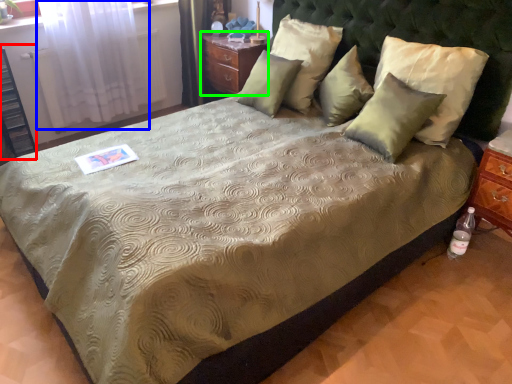
Question: Considering the real-world distances, which object is closest to dresser (highlighted by a red box)? curtain (highlighted by a blue box) or nightstand (highlighted by a green box).

Choices:
 (A) curtain
 (B) nightstand

Answer: (A)